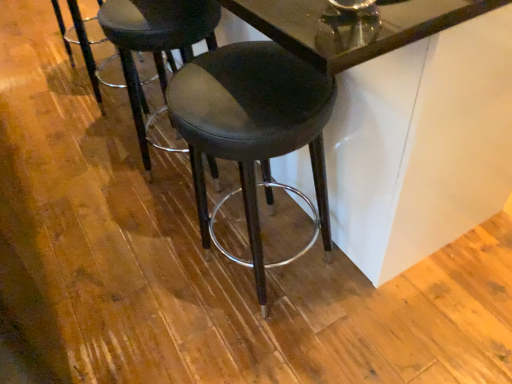
Question: Can you confirm if black leather stool at center, which is the second stool from left to right, is thinner than black leather stool at center?

Choices:
 (A) no
 (B) yes

Answer: (A)

Question: Does black leather stool at center, which is the second stool from left to right, come in front of black leather stool at center?

Choices:
 (A) yes
 (B) no

Answer: (A)

Question: Is black leather stool at center, which is the second stool from left to right, positioned far away from black leather stool at center?

Choices:
 (A) no
 (B) yes

Answer: (B)

Question: Is black leather stool at center, the 1th stool from the right, facing away from black leather stool at center?

Choices:
 (A) no
 (B) yes

Answer: (A)

Question: Is black leather stool at center, which is the second stool from left to right, smaller than black leather stool at center?

Choices:
 (A) no
 (B) yes

Answer: (A)

Question: Considering the relative sizes of black leather stool at center, the 1th stool from the right, and black leather stool at center in the image provided, is black leather stool at center, the 1th stool from the right, taller than black leather stool at center?

Choices:
 (A) no
 (B) yes

Answer: (B)

Question: Is matte black stool at center, which is counted as the 1th stool, starting from the left, shorter than black leather stool at center, the 1th stool from the right?

Choices:
 (A) yes
 (B) no

Answer: (A)

Question: From a real-world perspective, is matte black stool at center, which is counted as the 1th stool, starting from the left, below black leather stool at center, which is the second stool from left to right?

Choices:
 (A) yes
 (B) no

Answer: (A)

Question: From the image's perspective, is matte black stool at center, which is counted as the 1th stool, starting from the left, over black leather stool at center, the 1th stool from the right?

Choices:
 (A) yes
 (B) no

Answer: (A)

Question: From a real-world perspective, is matte black stool at center, the second stool when ordered from right to left, over black leather stool at center, the 1th stool from the right?

Choices:
 (A) yes
 (B) no

Answer: (B)

Question: Is matte black stool at center, the second stool when ordered from right to left, wider than black leather stool at center, the 1th stool from the right?

Choices:
 (A) no
 (B) yes

Answer: (A)

Question: Are matte black stool at center, which is counted as the 1th stool, starting from the left, and black leather stool at center, which is the second stool from left to right, far apart?

Choices:
 (A) yes
 (B) no

Answer: (B)

Question: From a real-world perspective, is glossy glass table at center under black leather stool at center?

Choices:
 (A) no
 (B) yes

Answer: (A)